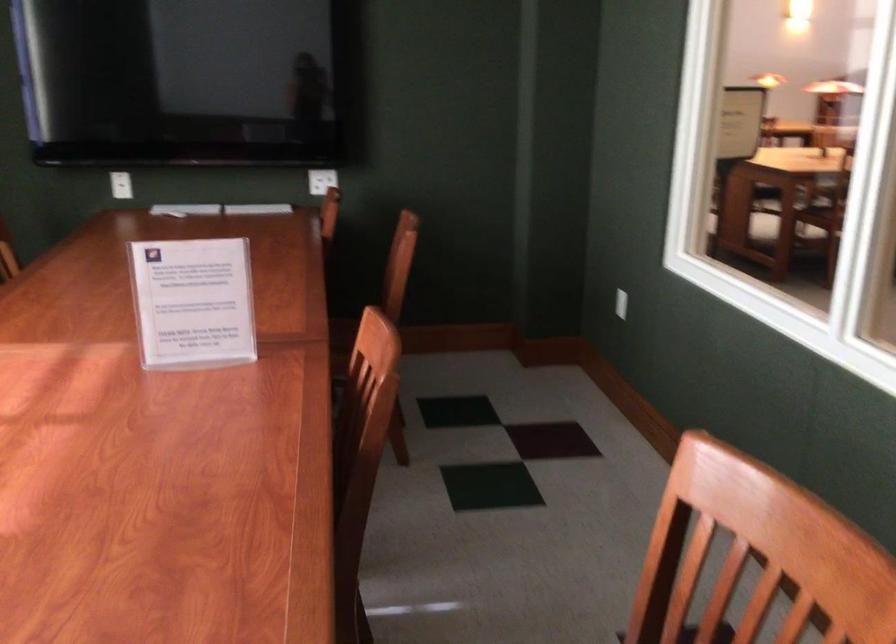
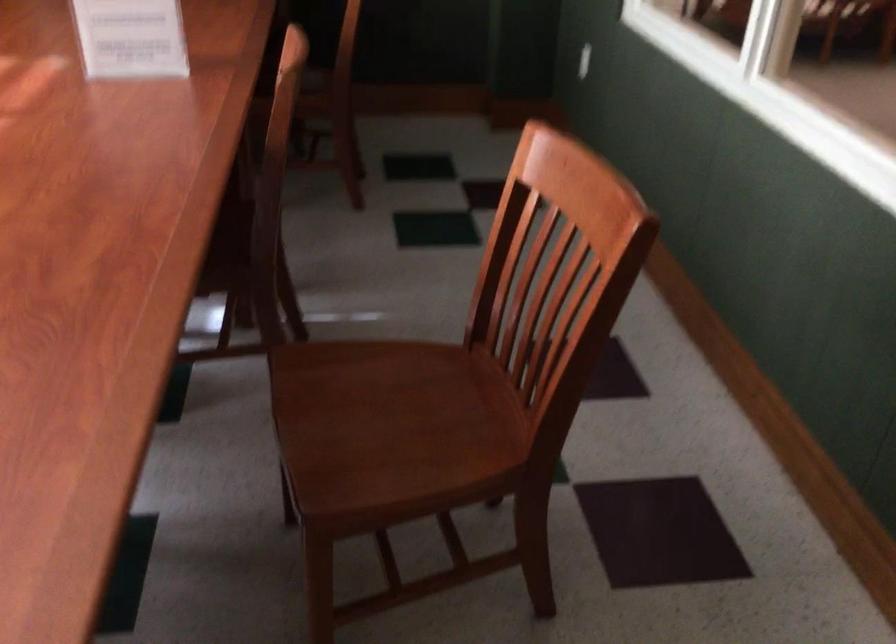
Question: The first image is from the beginning of the video and the second image is from the end. How did the camera likely rotate when shooting the video?

Choices:
 (A) Left
 (B) Right
 (C) Up
 (D) Down

Answer: (D)